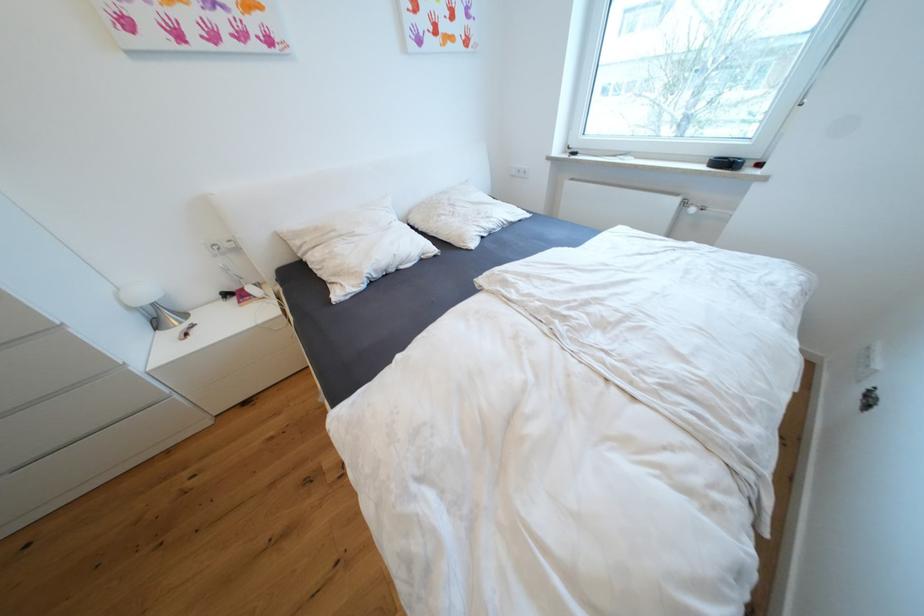
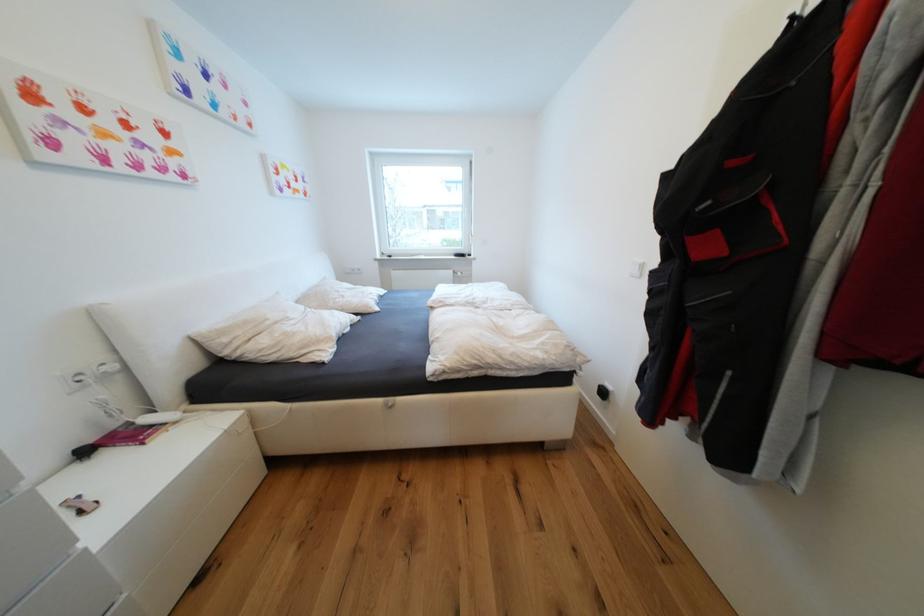
Where in the second image is the point corresponding to point 238,246 from the first image?

(119, 369)